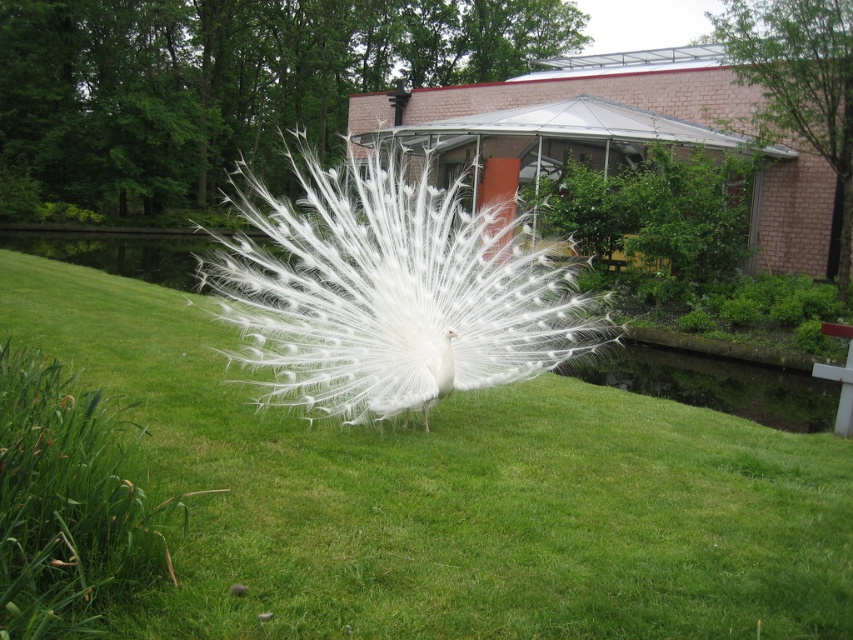
You are a photographer trying to capture the white feathered peacock at center and the green grassy at center in a single shot. Since you want the peacock to be the main focus, which object should you place closer to the left side of your camera frame?

The white feathered peacock at center should be placed closer to the left side of the camera frame so that it becomes the main focus while the green grassy at center remains on the right side as part of the background.